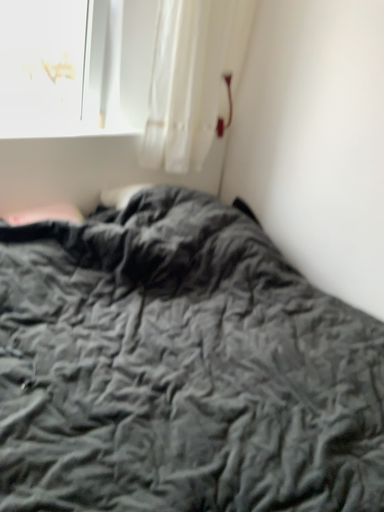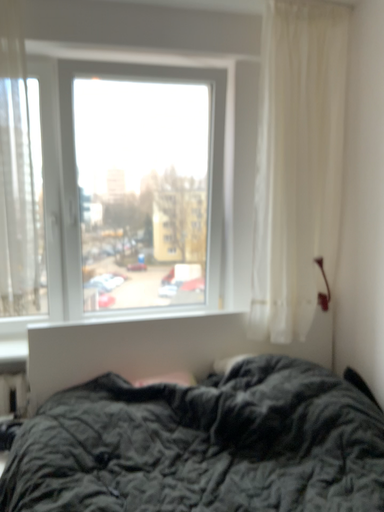
Question: Which way did the camera rotate in the video?

Choices:
 (A) rotated downward
 (B) rotated upward

Answer: (B)